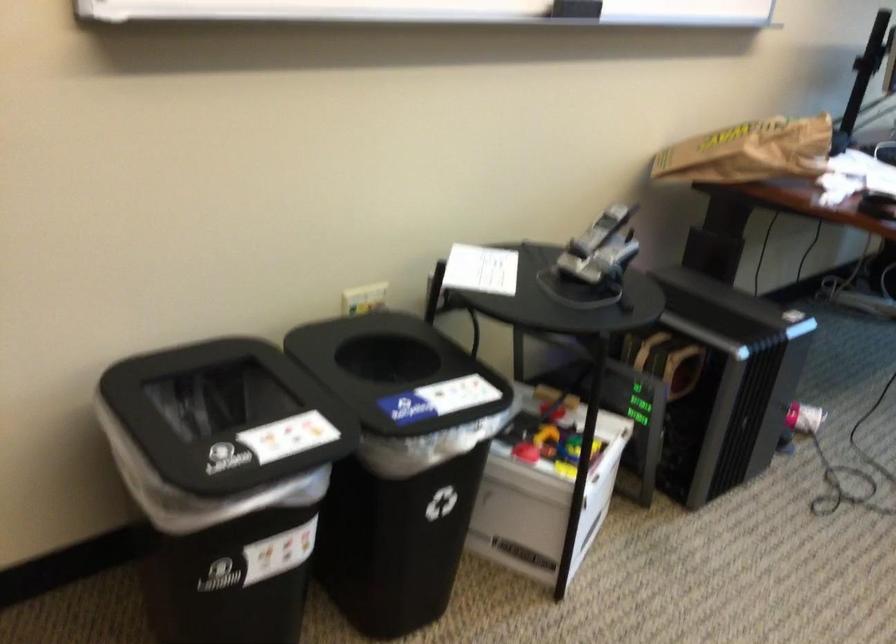
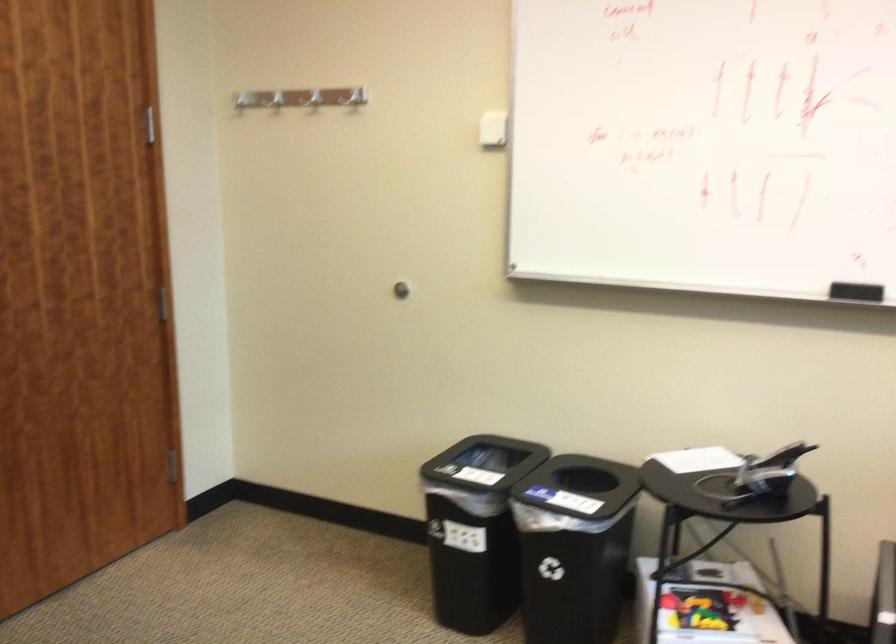
Question: I am providing you with two images of the same scene from different viewpoints. After the viewpoint changes to image2, which objects are now occluded?

Choices:
 (A) black whiteboard eraser
 (B) colorful toy block
 (C) silver coat hook
 (D) none of these

Answer: (D)